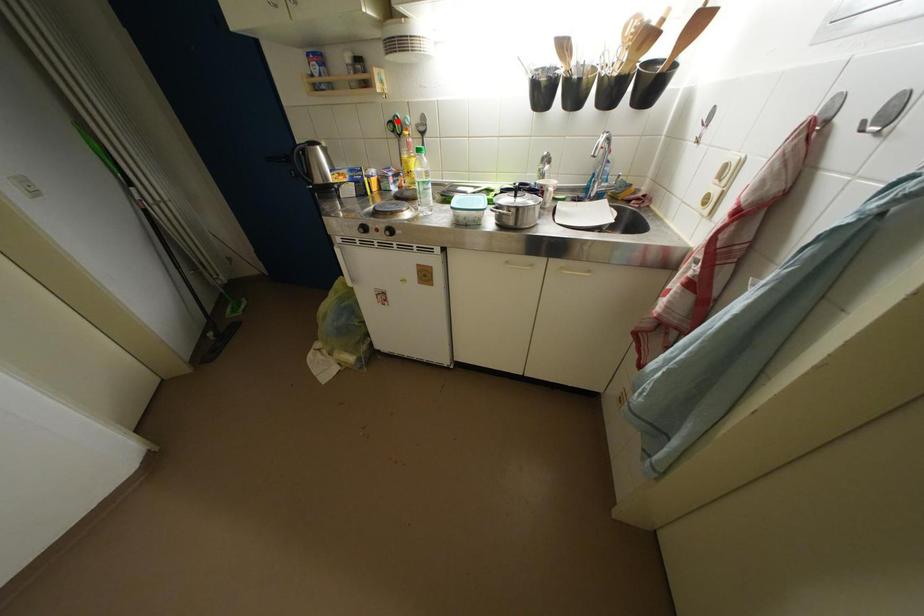
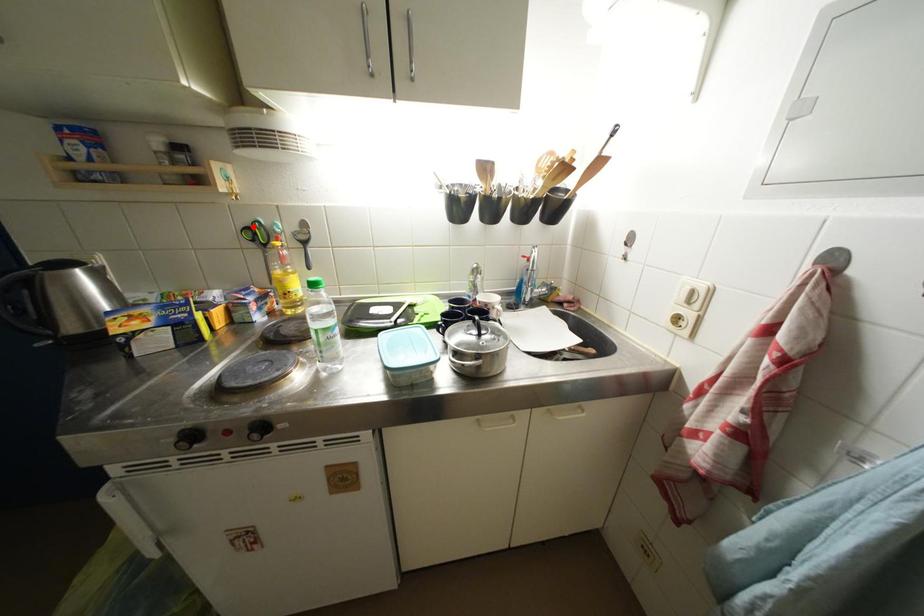
I am providing you with two images of the same scene from different viewpoints. A red point is marked on the first image and another point is marked on the second image. Does the point marked in image1 correspond to the same location as the one in image2?

Yes